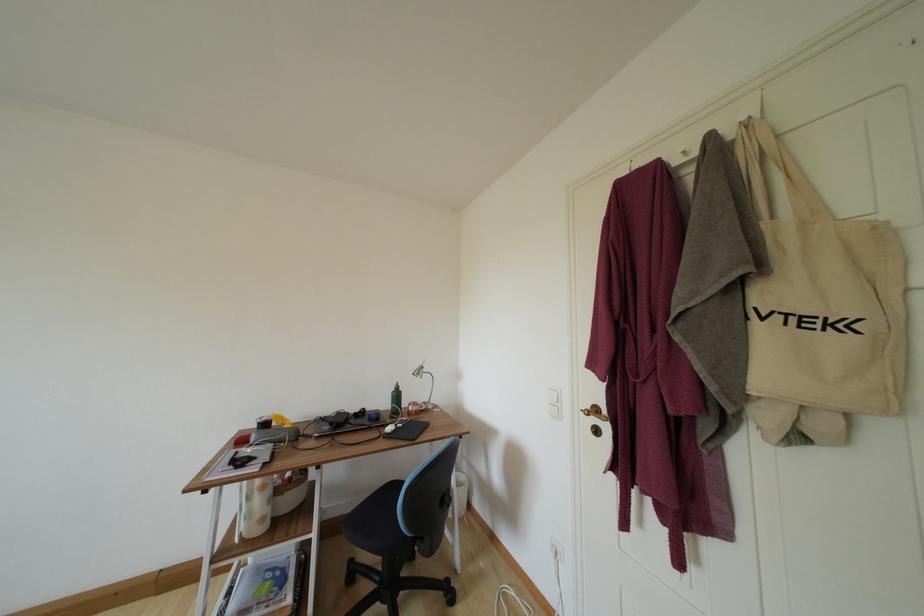
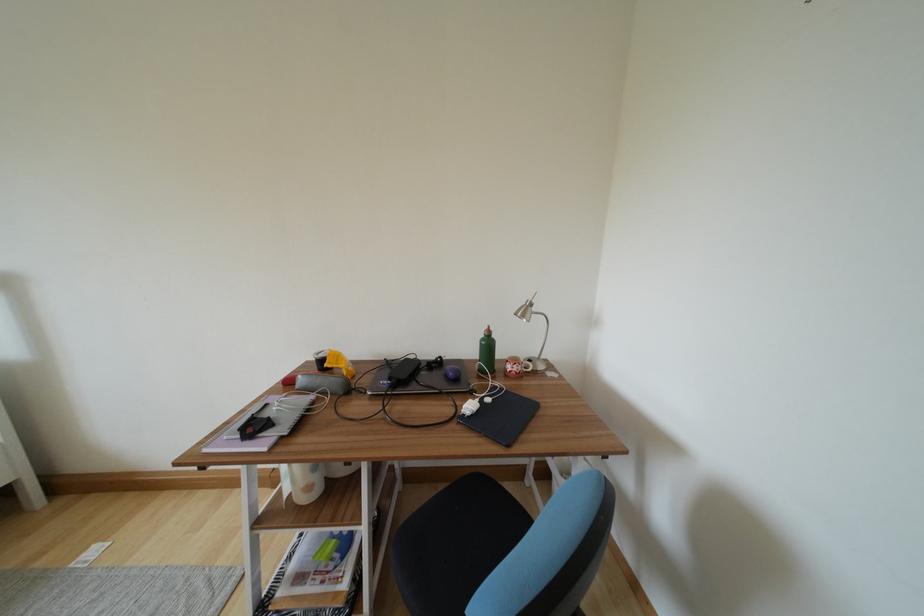
In the second image, find the point that corresponds to (x=422, y=378) in the first image.

(528, 320)